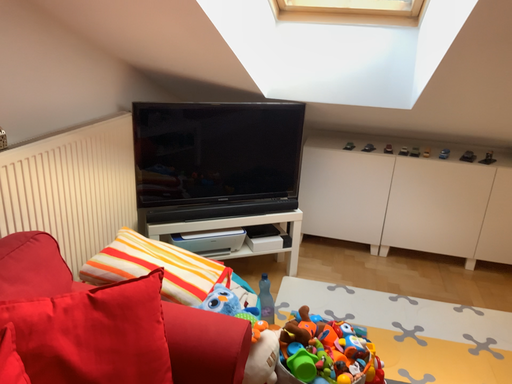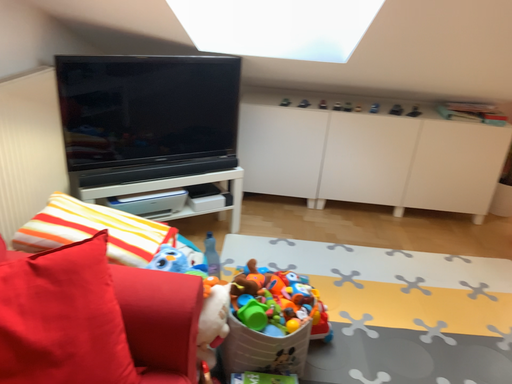
Question: Which way did the camera rotate in the video?

Choices:
 (A) rotated left
 (B) rotated right

Answer: (B)